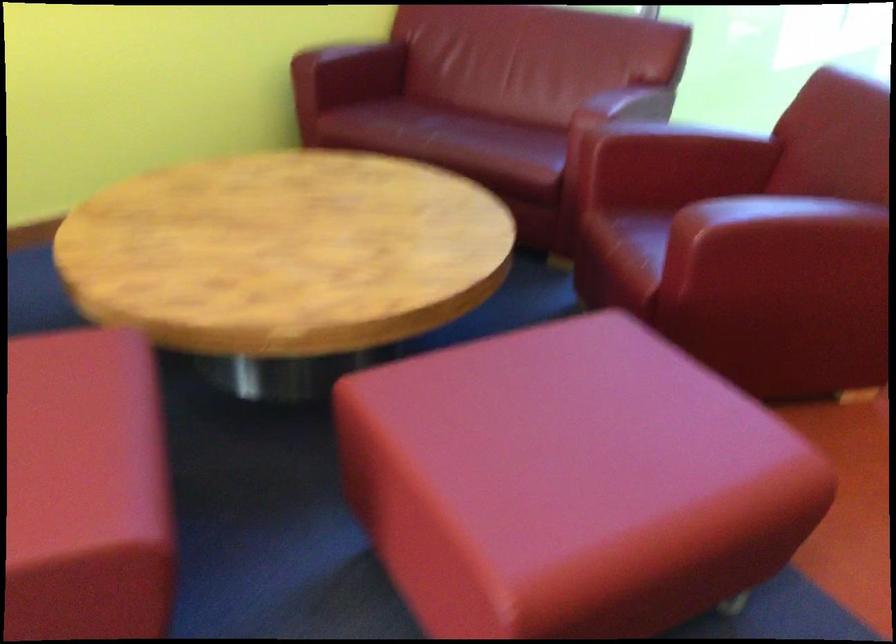
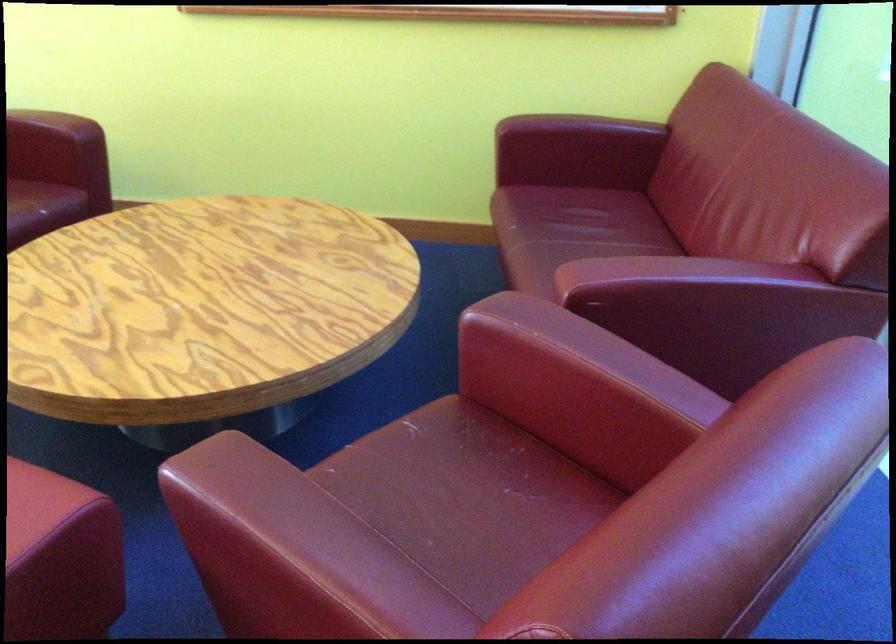
Where in the second image is the point corresponding to pixel 648 114 from the first image?

(787, 323)